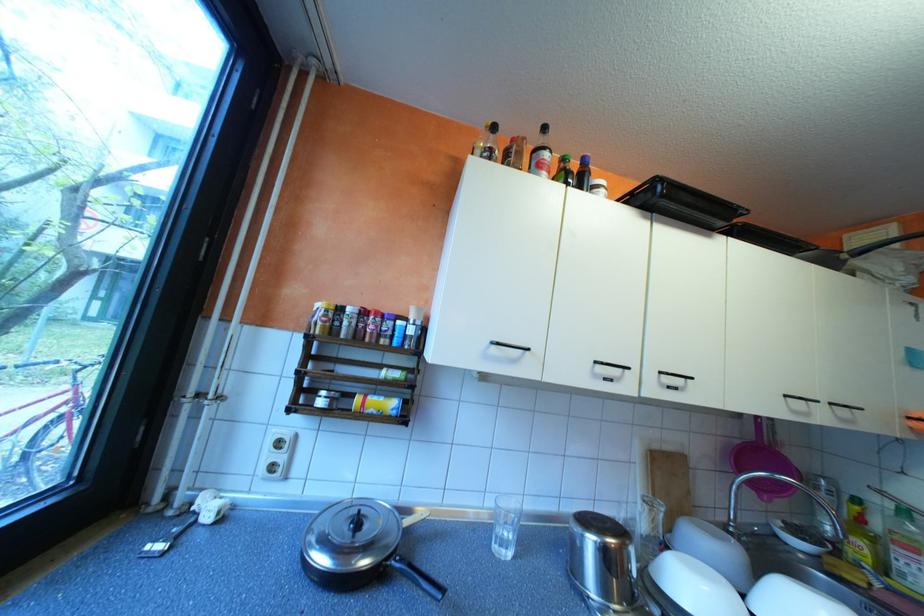
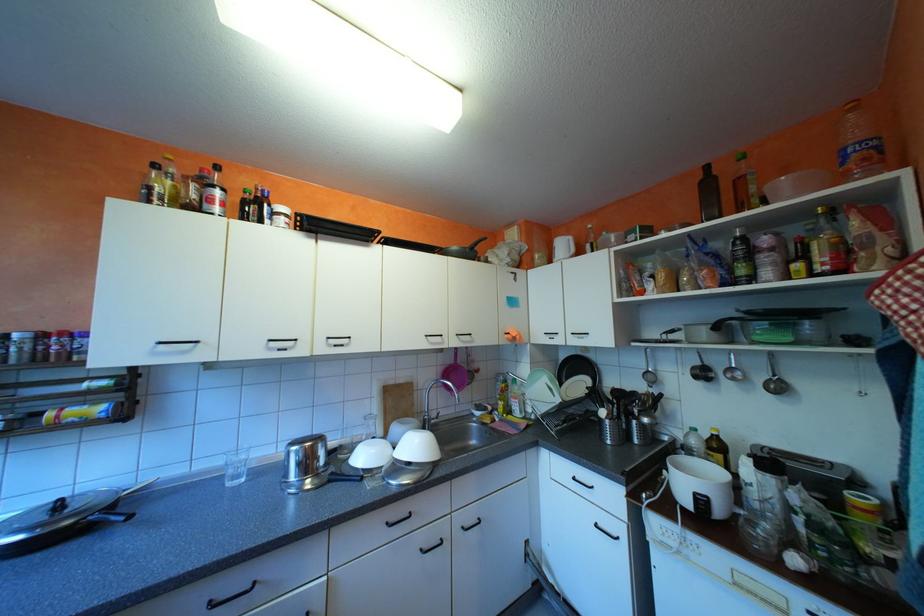
Question: The images are taken continuously from a first-person perspective. In which direction is your viewpoint rotating?

Choices:
 (A) Left
 (B) Right
 (C) Up
 (D) Down

Answer: (B)